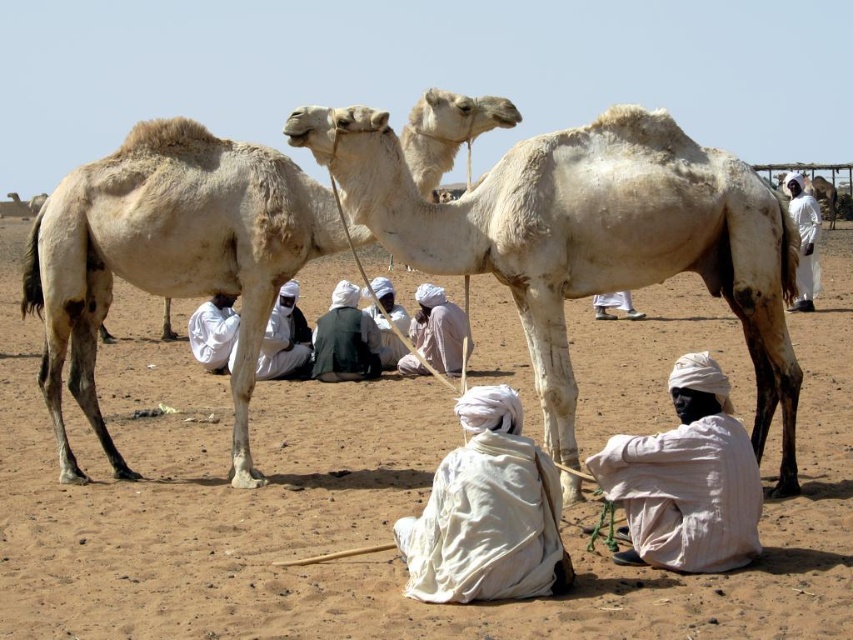
Is white cloth at lower right below white cloth at right?

Yes.

Which is behind, point (759, 492) or point (807, 307)?

Positioned behind is point (807, 307).

Is point (672, 396) behind point (798, 296)?

No, it is in front of (798, 296).

The height and width of the screenshot is (640, 853). What are the coordinates of `white cloth at lower right` in the screenshot? It's located at (686, 480).

The image size is (853, 640). Describe the element at coordinates (283, 337) in the screenshot. I see `white cloth at center` at that location.

In the scene shown: Does white cloth at center appear on the left side of white cloth at right?

Indeed, white cloth at center is positioned on the left side of white cloth at right.

Does point (216, 369) come behind point (819, 212)?

No, it is in front of (819, 212).

Locate an element on the screen. white cloth at center is located at coordinates (283, 337).

Does dark green fabric at center have a lesser width compared to light beige fabric turban at center?

Yes.

Which is in front, point (367, 364) or point (440, 301)?

Point (367, 364) is more forward.

You are a GUI agent. You are given a task and a screenshot of the screen. Output one action in this format:
    pyautogui.click(x=<x>, y=<y>)
    Task: Click on the dark green fabric at center
    The width and height of the screenshot is (853, 640).
    Given the screenshot: What is the action you would take?
    pyautogui.click(x=345, y=339)